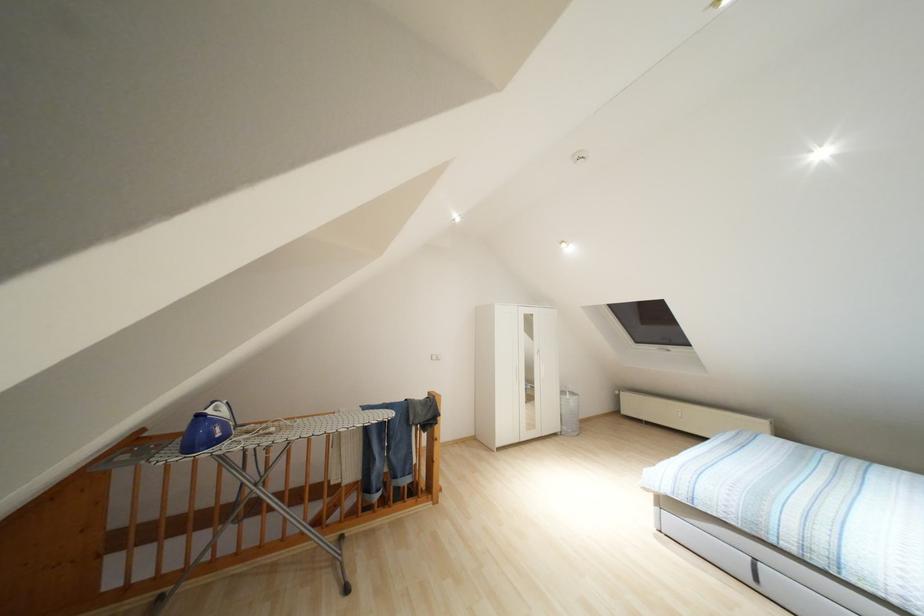
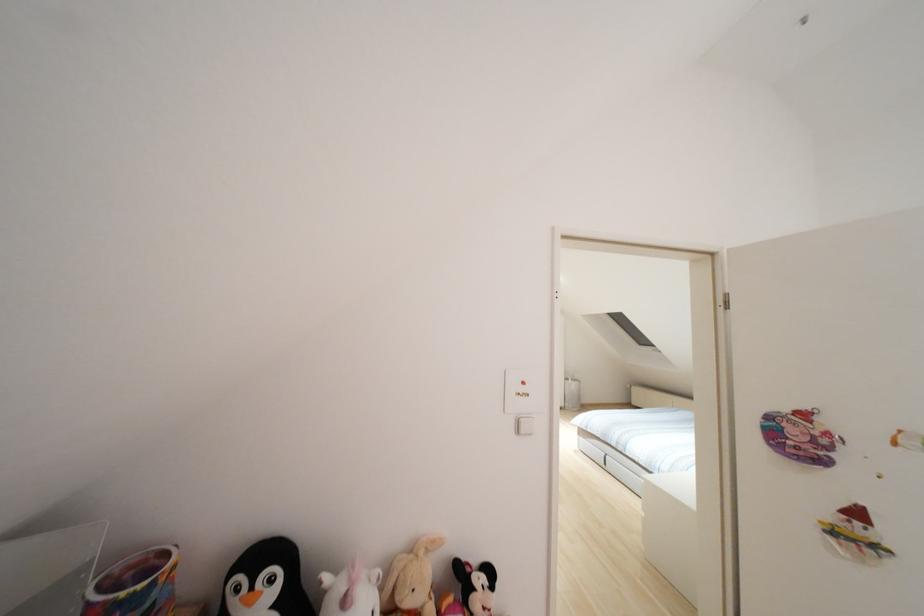
In a continuous first-person perspective shot, in which direction is the camera moving?

The cameraman moved toward right, backward.